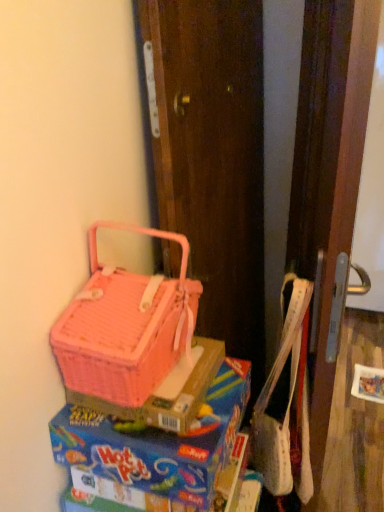
Question: Is point coord(175,418) positioned closer to the camera than point coord(226,398)?

Choices:
 (A) farther
 (B) closer

Answer: (B)

Question: In terms of height, does pink wicker basket at upper left look taller or shorter compared to pink plastic lunch box at lower left?

Choices:
 (A) short
 (B) tall

Answer: (A)

Question: Which is nearer to the pink wicker basket at upper left?

Choices:
 (A) pink wicker picnic basket at left
 (B) pink plastic lunch box at lower left
 (C) wooden screen door at right

Answer: (B)

Question: Based on their relative distances, which object is farther from the pink wicker picnic basket at left?

Choices:
 (A) wooden screen door at right
 (B) pink wicker basket at upper left
 (C) pink plastic lunch box at lower left

Answer: (A)